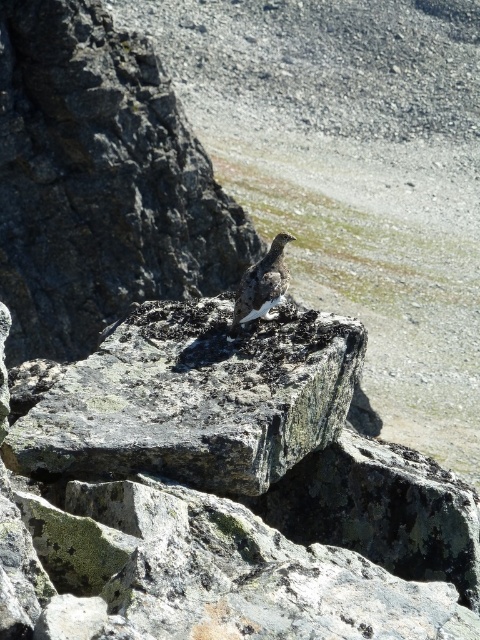
Between gray rough rock at center and white speckled rock at center, which one appears on the left side from the viewer's perspective?

gray rough rock at center

Can you confirm if gray rough rock at center is thinner than white speckled rock at center?

Incorrect, gray rough rock at center's width is not less than white speckled rock at center's.

Image resolution: width=480 pixels, height=640 pixels. Find the location of `gray rough rock at center`. gray rough rock at center is located at coordinates (194, 400).

Consider the image. Which is more to the right, rough gray rock at center or gray rough rock at center?

Positioned to the right is gray rough rock at center.

Is point (70, 353) behind point (354, 356)?

Yes, it is behind point (354, 356).

The width and height of the screenshot is (480, 640). I want to click on rough gray rock at center, so click(x=99, y=182).

Who is positioned more to the left, rough gray rock at center or white speckled rock at center?

rough gray rock at center

You are a GUI agent. You are given a task and a screenshot of the screen. Output one action in this format:
    pyautogui.click(x=<x>, y=<y>)
    Task: Click on the rough gray rock at center
    
    Given the screenshot: What is the action you would take?
    pyautogui.click(x=99, y=182)